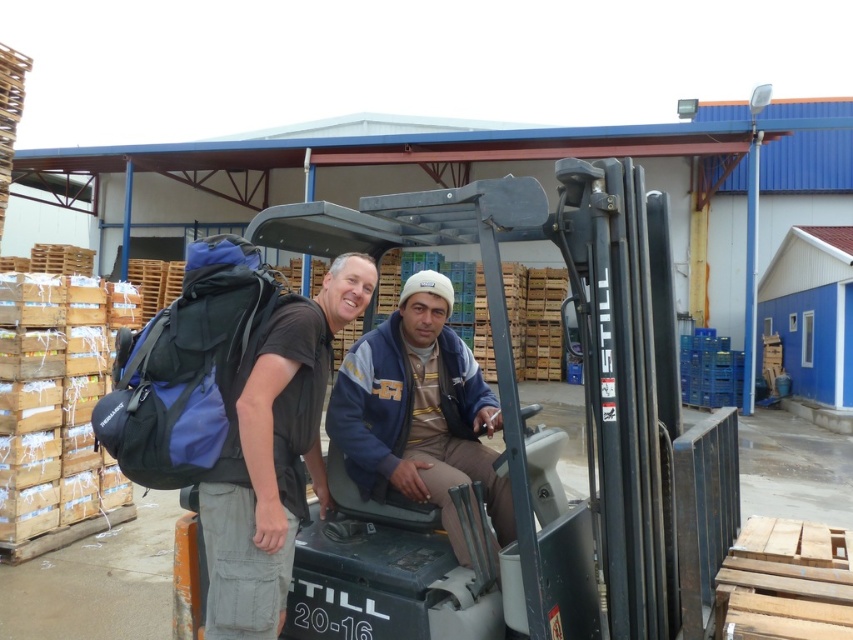
You are a warehouse worker who needs to store the dark blue backpack at left and the blue fleece jacket at center. Which item requires a larger storage space?

The dark blue backpack at left requires a larger storage space because it is bigger than the blue fleece jacket at center.

Based on the photo, you are a delivery person who needs to place the dark blue backpack at left and the blue fleece jacket at center into a storage locker. The locker has a height limit of 1.2 meters. Can both items fit vertically without exceeding the height limit?

The dark blue backpack at left is much taller than the blue fleece jacket at center. Since the locker has a height limit of 1.2 meters, we need to know the exact heights of both items. However, the description only states their relative sizes. Without specific measurements, it is impossible to determine if both will fit within the 1.2 meter limit.